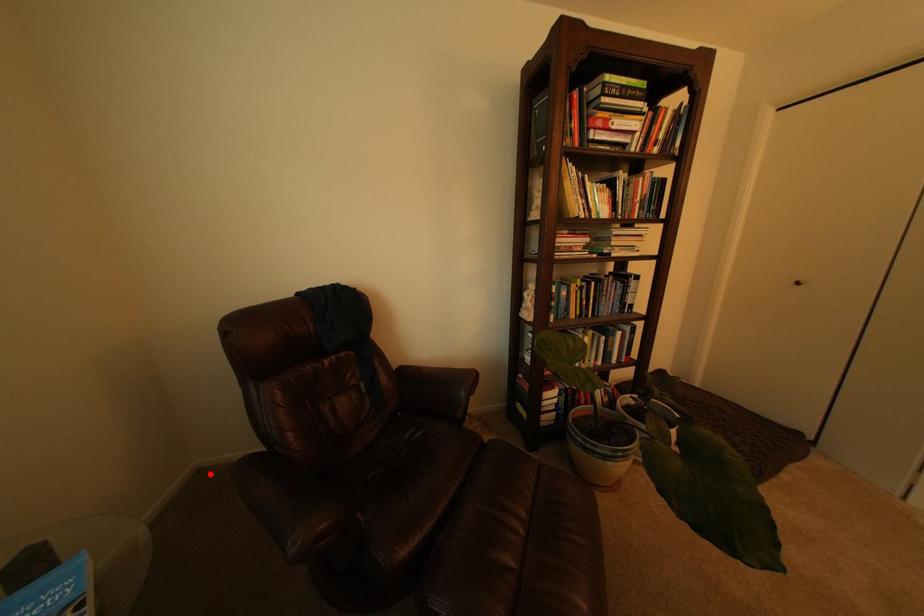
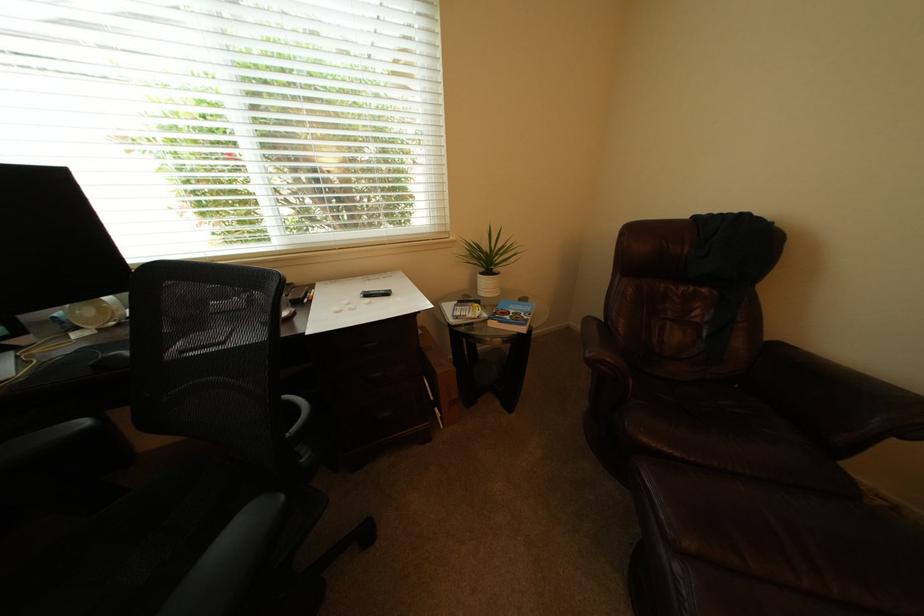
Locate, in the second image, the point that corresponds to the highlighted location in the first image.

(579, 331)